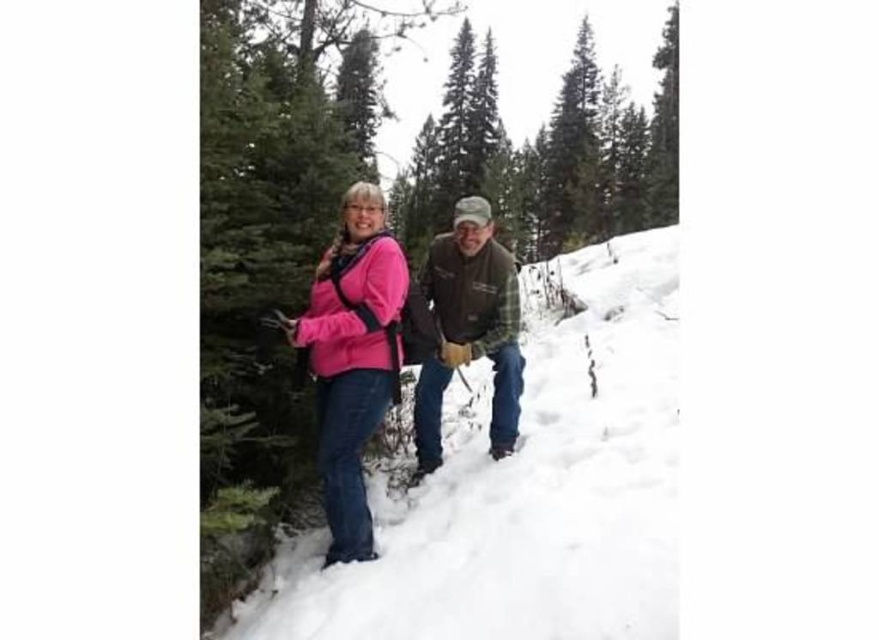
You are a hiker who wants to find the point at coordinate (x=356, y=355) in the snowy forest scene. Which object is this point located on?

The point at coordinate (x=356, y=355) is located on the pink fleece jacket at center.

You are a photographer standing in the snowy forest scene. You want to take a photo that includes both the woman in the bright pink jacket and the man with the green cap. The woman is at point [543,499] and the man is at point [331,282]. Which of the two points is closer to you so that you can focus on them better?

Point [543,499] is closer to the viewer than point [331,282], so focusing on the woman at point [543,499] would allow better focus since she is nearer.